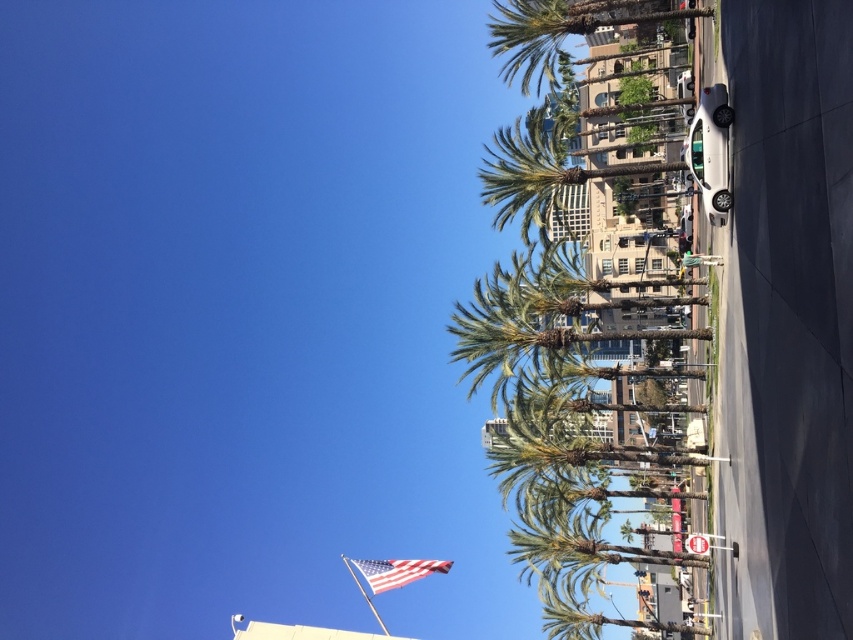
Question: Which object appears closest to the camera in this image?

Choices:
 (A) american flag at center
 (B) green leafy palm tree at center
 (C) green leafy palm tree at upper center

Answer: (A)

Question: Based on their relative distances, which object is nearer to the green leafy palm tree at upper center?

Choices:
 (A) american flag at center
 (B) green leafy palm tree at center

Answer: (B)

Question: Does green leafy palm tree at upper center appear on the right side of american flag at center?

Choices:
 (A) no
 (B) yes

Answer: (B)

Question: Is green leafy palm tree at center to the right of american flag at center from the viewer's perspective?

Choices:
 (A) no
 (B) yes

Answer: (B)

Question: Which point is farther from the camera taking this photo?

Choices:
 (A) (390, 577)
 (B) (567, 24)

Answer: (B)

Question: Does green leafy palm tree at center have a smaller size compared to american flag at center?

Choices:
 (A) yes
 (B) no

Answer: (A)